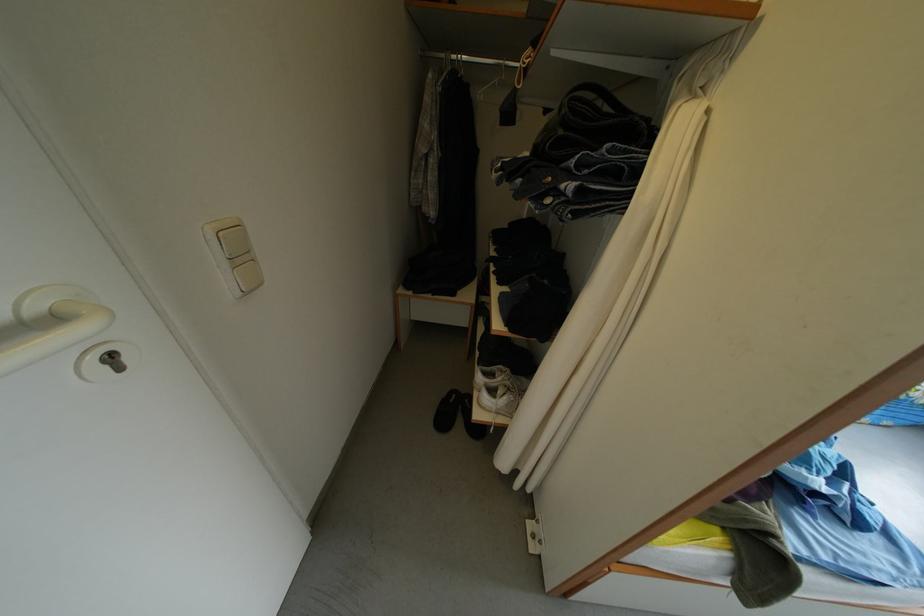
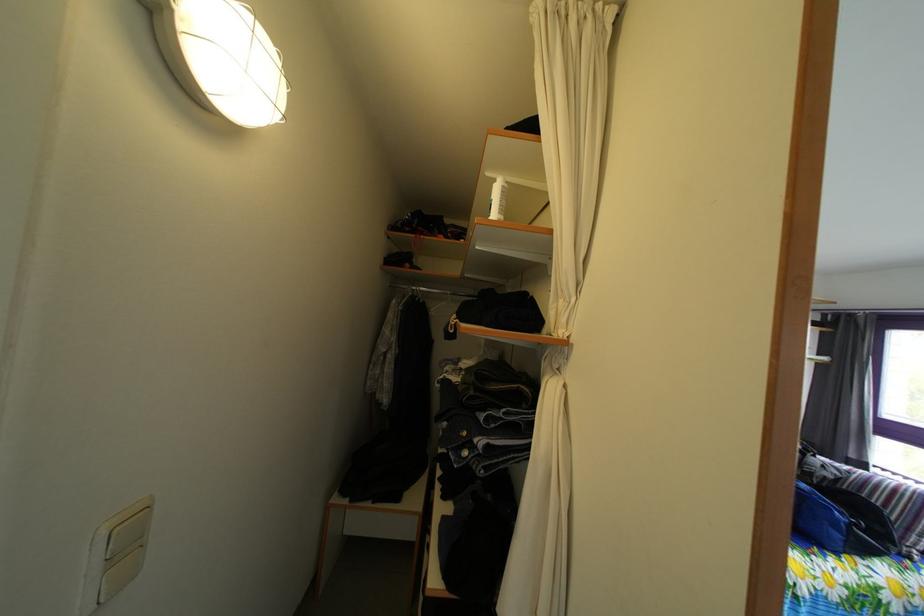
Question: I am providing you with two images of the same scene from different viewpoints. After the viewpoint changes to image2, which objects are now occluded?

Choices:
 (A) light switch button
 (B) clothes hanger hook
 (C) white spray bottle
 (D) none of these

Answer: (D)